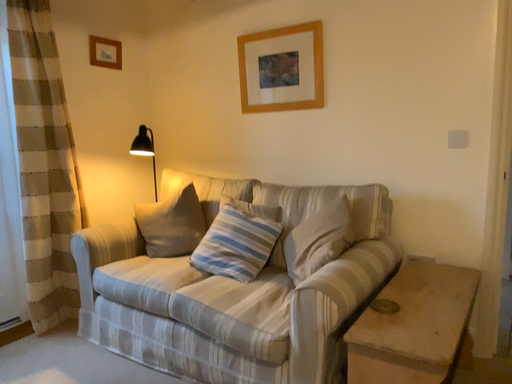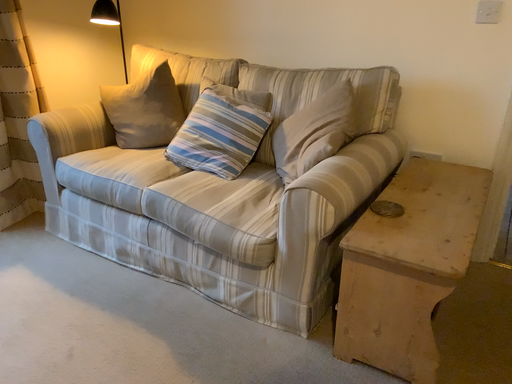
Question: Which way did the camera rotate in the video?

Choices:
 (A) rotated downward
 (B) rotated upward

Answer: (A)